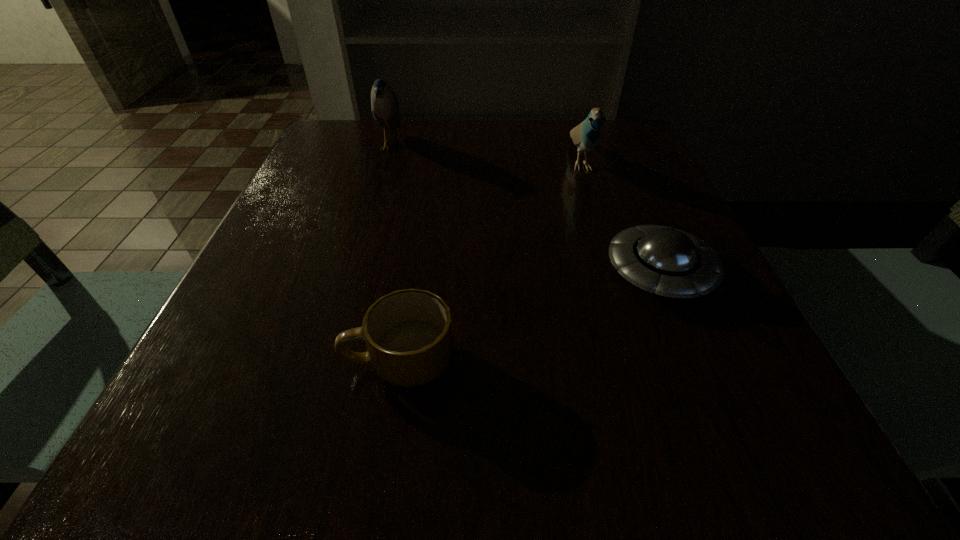
At what (x,y) coordinates should I click in order to perform the action: click on the right bird. Please return your answer as a coordinate pair (x, y). Image resolution: width=960 pixels, height=540 pixels. Looking at the image, I should click on (586, 135).

At what (x,y) coordinates should I click in order to perform the action: click on the leftmost object. Please return your answer as a coordinate pair (x, y). Looking at the image, I should click on (384, 105).

Locate an element on the screen. This screenshot has height=540, width=960. the second object from left to right is located at coordinates (408, 333).

At what (x,y) coordinates should I click in order to perform the action: click on mug. Please return your answer as a coordinate pair (x, y). This screenshot has height=540, width=960. Looking at the image, I should click on (408, 333).

At what (x,y) coordinates should I click in order to perform the action: click on saucer. Please return your answer as a coordinate pair (x, y). The width and height of the screenshot is (960, 540). Looking at the image, I should click on (672, 263).

Identify the location of vacant space located at the face of the right bird. The image size is (960, 540). (623, 296).

I want to click on vacant space situated 0.390m at the tip of the leftmost object's beak, so click(x=565, y=146).

Locate an element on the screen. Image resolution: width=960 pixels, height=540 pixels. free region located 0.160m on the side with the handle of the nearest object is located at coordinates (230, 361).

At what (x,y) coordinates should I click in order to perform the action: click on vacant area situated on the side with the handle of the nearest object. Please return your answer as a coordinate pair (x, y). The width and height of the screenshot is (960, 540). Looking at the image, I should click on [x=274, y=361].

Where is `vacant space located on the side with the handle of the nearest object`? This screenshot has height=540, width=960. vacant space located on the side with the handle of the nearest object is located at coordinates (223, 361).